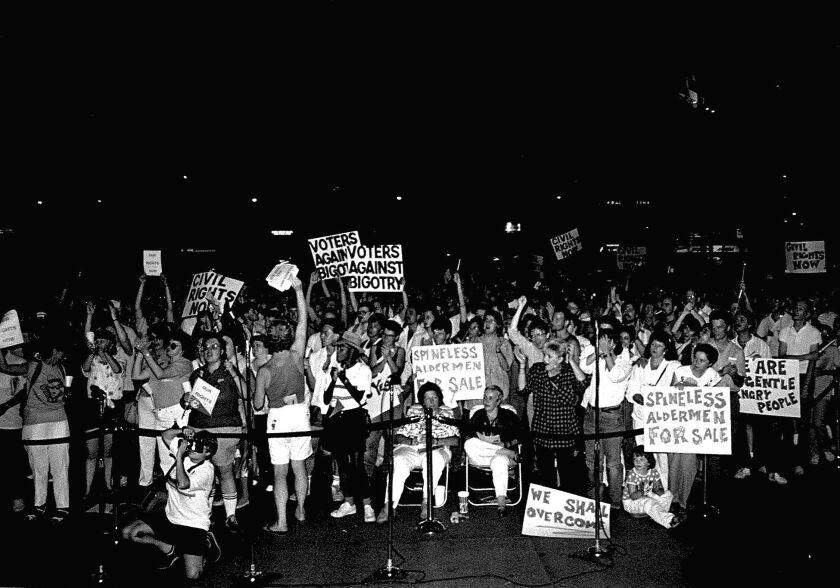
In order to click on cord in this screenshot , I will do `click(438, 574)`.